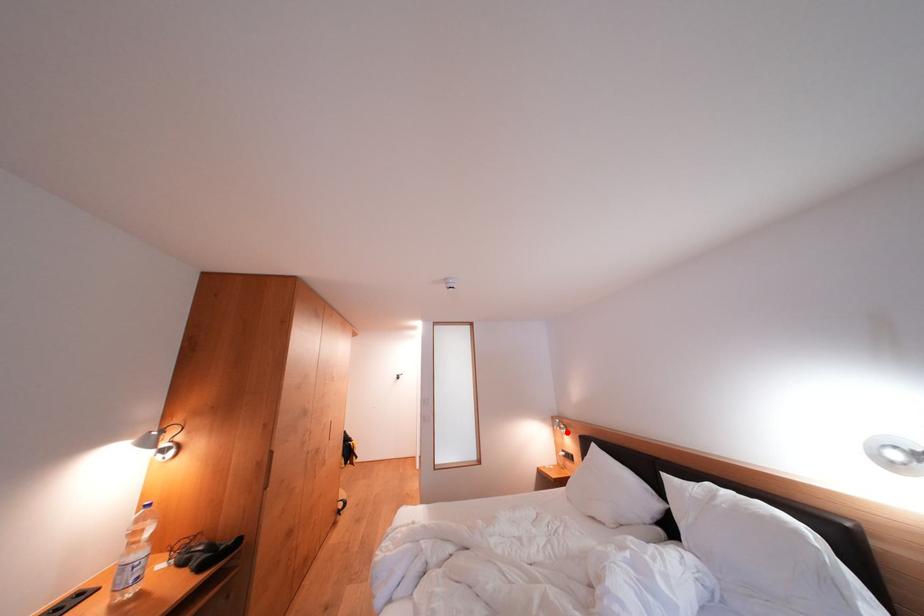
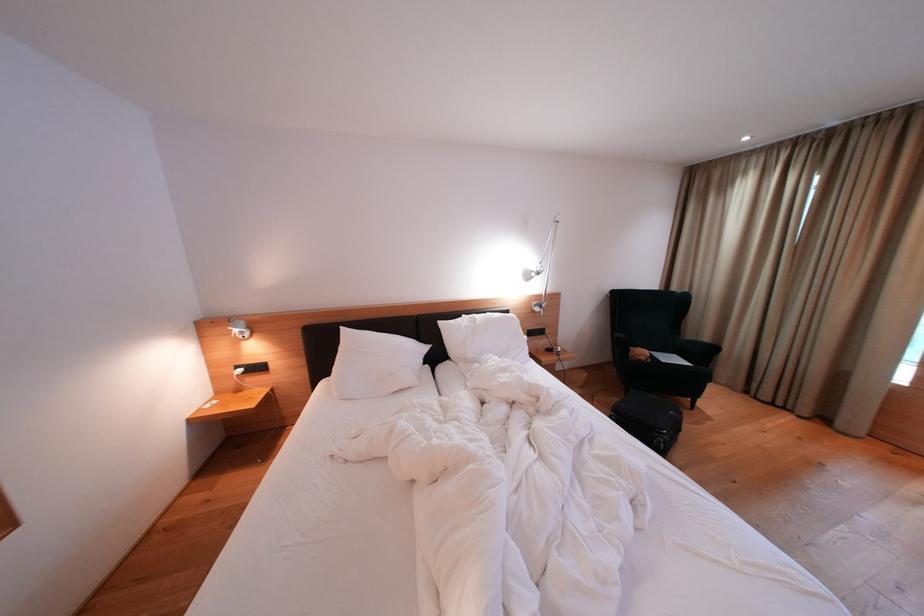
Question: I am providing you with two images of the same scene from different viewpoints. In image1, a red point is highlighted. Considering the same 3D point in image2, which of the following is correct?

Choices:
 (A) It is closer
 (B) It is farther

Answer: (A)